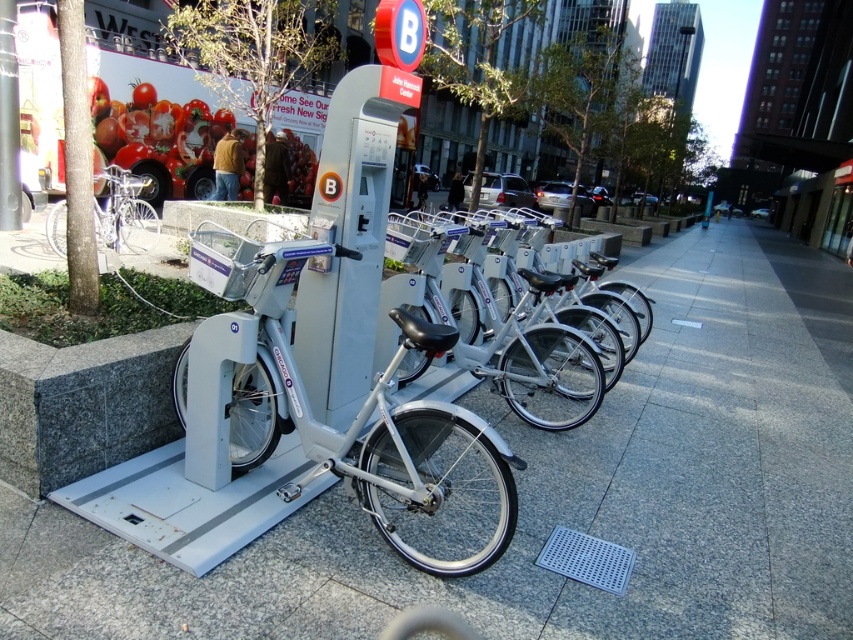
Question: Which point is farther to the camera?

Choices:
 (A) (759, 586)
 (B) (100, 224)

Answer: (B)

Question: Among these points, which one is nearest to the camera?

Choices:
 (A) (49, 221)
 (B) (686, 240)

Answer: (A)

Question: Is silver metallic pavement at center further to the viewer compared to silver metallic bicycle at left?

Choices:
 (A) no
 (B) yes

Answer: (A)

Question: Can you confirm if silver metallic pavement at center is positioned to the left of silver metallic bicycle at left?

Choices:
 (A) no
 (B) yes

Answer: (A)

Question: Which point appears farthest from the camera in this image?

Choices:
 (A) (712, 384)
 (B) (131, 237)

Answer: (B)

Question: Does silver metallic pavement at center appear over silver metallic bicycle at left?

Choices:
 (A) no
 (B) yes

Answer: (A)